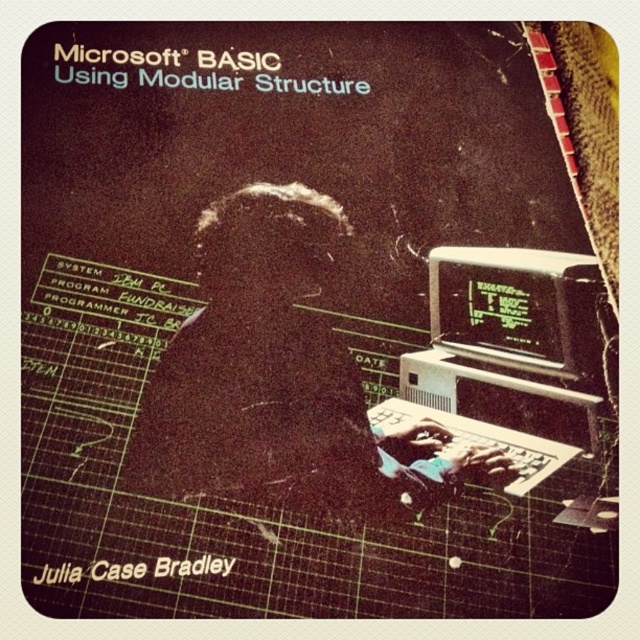
Question: Which point is closer to the camera taking this photo?

Choices:
 (A) (541, 384)
 (B) (508, 280)

Answer: (A)

Question: Which object appears closest to the camera in this image?

Choices:
 (A) black plastic monitor at right
 (B) white plastic computer at center

Answer: (B)

Question: Does white plastic computer at center appear over black plastic monitor at right?

Choices:
 (A) yes
 (B) no

Answer: (B)

Question: In this image, where is white plastic computer at center located relative to black plastic monitor at right?

Choices:
 (A) below
 (B) above

Answer: (A)

Question: Which object is farther from the camera taking this photo?

Choices:
 (A) white plastic computer at center
 (B) black plastic monitor at right

Answer: (B)

Question: Can you confirm if white plastic computer at center is positioned below black plastic monitor at right?

Choices:
 (A) no
 (B) yes

Answer: (B)